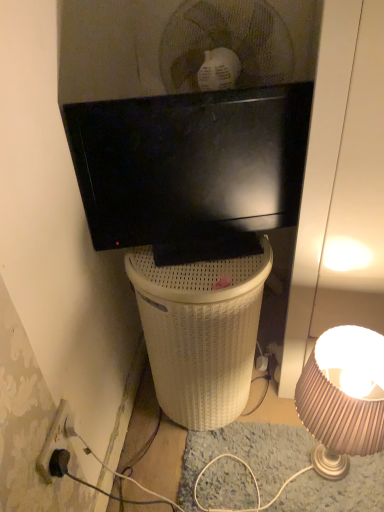
Question: Is matte black tv at upper center not close to matte beige lampshade at lower right?

Choices:
 (A) yes
 (B) no

Answer: (B)

Question: From a real-world perspective, is matte black tv at upper center beneath matte beige lampshade at lower right?

Choices:
 (A) no
 (B) yes

Answer: (A)

Question: Does matte black tv at upper center have a lesser height compared to matte beige lampshade at lower right?

Choices:
 (A) no
 (B) yes

Answer: (B)

Question: From the image's perspective, is matte black tv at upper center located beneath matte beige lampshade at lower right?

Choices:
 (A) yes
 (B) no

Answer: (B)

Question: Does matte black tv at upper center appear on the right side of matte beige lampshade at lower right?

Choices:
 (A) no
 (B) yes

Answer: (A)

Question: Could you tell me if matte black tv at upper center is turned towards matte beige lampshade at lower right?

Choices:
 (A) yes
 (B) no

Answer: (B)

Question: Considering the relative positions of white wicker trash bin/can at center and matte black tv at upper center in the image provided, is white wicker trash bin/can at center behind matte black tv at upper center?

Choices:
 (A) yes
 (B) no

Answer: (A)

Question: Considering the relative sizes of white wicker trash bin/can at center and matte black tv at upper center in the image provided, is white wicker trash bin/can at center bigger than matte black tv at upper center?

Choices:
 (A) yes
 (B) no

Answer: (A)

Question: Is matte black tv at upper center completely or partially inside white wicker trash bin/can at center?

Choices:
 (A) no
 (B) yes

Answer: (A)

Question: Is white wicker trash bin/can at center at the right side of matte black tv at upper center?

Choices:
 (A) yes
 (B) no

Answer: (B)

Question: From a real-world perspective, is white wicker trash bin/can at center physically above matte black tv at upper center?

Choices:
 (A) yes
 (B) no

Answer: (B)

Question: From the image's perspective, would you say white wicker trash bin/can at center is shown under matte black tv at upper center?

Choices:
 (A) no
 (B) yes

Answer: (B)

Question: From the image's perspective, would you say matte beige lampshade at lower right is shown under black plastic power outlet at lower left?

Choices:
 (A) yes
 (B) no

Answer: (A)